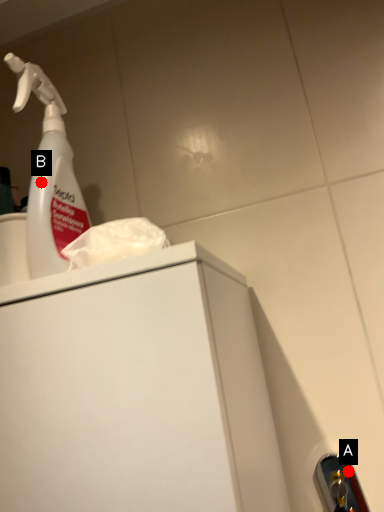
Question: Two points are circled on the image, labeled by A and B beside each circle. Which point appears farthest from the camera in this image?

Choices:
 (A) A is further
 (B) B is further

Answer: (A)